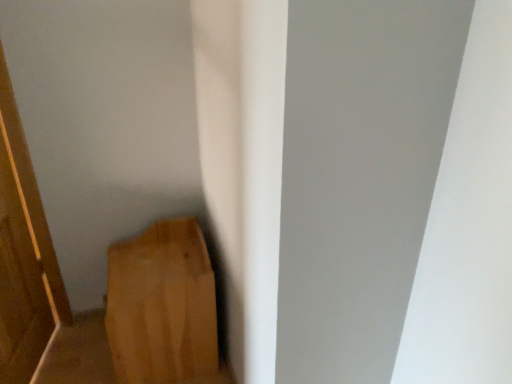
Question: Is wooden door at left looking in the opposite direction of wooden plank at lower left?

Choices:
 (A) no
 (B) yes

Answer: (B)

Question: Can you confirm if wooden door at left is shorter than wooden plank at lower left?

Choices:
 (A) yes
 (B) no

Answer: (B)

Question: Does wooden door at left have a larger size compared to wooden plank at lower left?

Choices:
 (A) no
 (B) yes

Answer: (A)

Question: From a real-world perspective, is wooden door at left over wooden plank at lower left?

Choices:
 (A) yes
 (B) no

Answer: (A)

Question: Can we say wooden door at left lies outside wooden plank at lower left?

Choices:
 (A) yes
 (B) no

Answer: (A)

Question: Is wooden door at left facing towards wooden plank at lower left?

Choices:
 (A) yes
 (B) no

Answer: (B)

Question: From a real-world perspective, is wooden plank at lower left located beneath wooden door at left?

Choices:
 (A) no
 (B) yes

Answer: (B)

Question: Does wooden plank at lower left touch wooden door at left?

Choices:
 (A) yes
 (B) no

Answer: (B)

Question: Does wooden plank at lower left appear on the right side of wooden door at left?

Choices:
 (A) yes
 (B) no

Answer: (A)

Question: Is wooden door at left a part of wooden plank at lower left?

Choices:
 (A) yes
 (B) no

Answer: (B)

Question: Does wooden plank at lower left have a greater width compared to wooden door at left?

Choices:
 (A) yes
 (B) no

Answer: (A)

Question: From a real-world perspective, is wooden plank at lower left located higher than wooden door at left?

Choices:
 (A) no
 (B) yes

Answer: (A)

Question: Is wooden door at left in front of or behind wooden plank at lower left in the image?

Choices:
 (A) behind
 (B) front

Answer: (B)